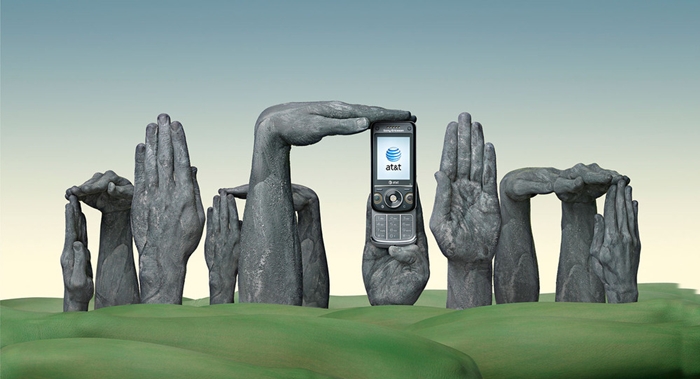
Identify the location of phone. (400, 190).